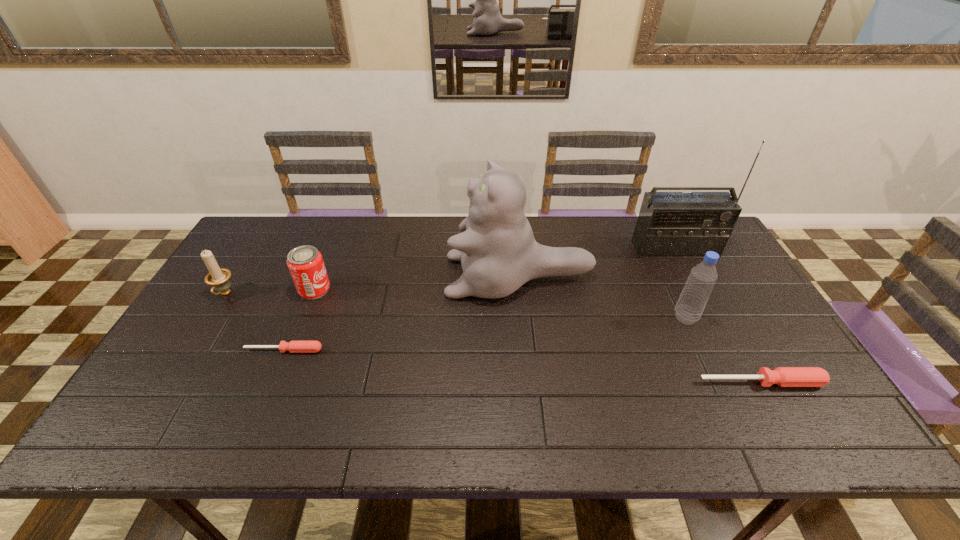
Where is `free spot located on the back of the left screwdriver`? This screenshot has height=540, width=960. free spot located on the back of the left screwdriver is located at coordinates (325, 251).

The width and height of the screenshot is (960, 540). I want to click on vacant space situated 0.170m on the back of the taller screwdriver, so click(x=729, y=323).

Identify the location of vacant area situated 0.210m on the left of the third shortest object. This screenshot has width=960, height=540. (228, 289).

The image size is (960, 540). Identify the location of blank space located 0.060m on the front panel of the radio receiver. (686, 271).

This screenshot has width=960, height=540. Find the location of `vacant region located 0.370m on the face of the fourth object from left to right`. vacant region located 0.370m on the face of the fourth object from left to right is located at coordinates (325, 276).

Identify the location of vacant position located 0.280m on the face of the fourth object from left to right. (354, 276).

Identify the location of free space located 0.290m on the face of the fourth object from left to right. This screenshot has width=960, height=540. (351, 276).

Identify the location of free point located on the handle side of the candle_holder. The width and height of the screenshot is (960, 540). (199, 337).

Where is `free spot located on the back of the third tallest object`? free spot located on the back of the third tallest object is located at coordinates (662, 269).

Image resolution: width=960 pixels, height=540 pixels. I want to click on radio receiver that is positioned at the far edge, so click(670, 224).